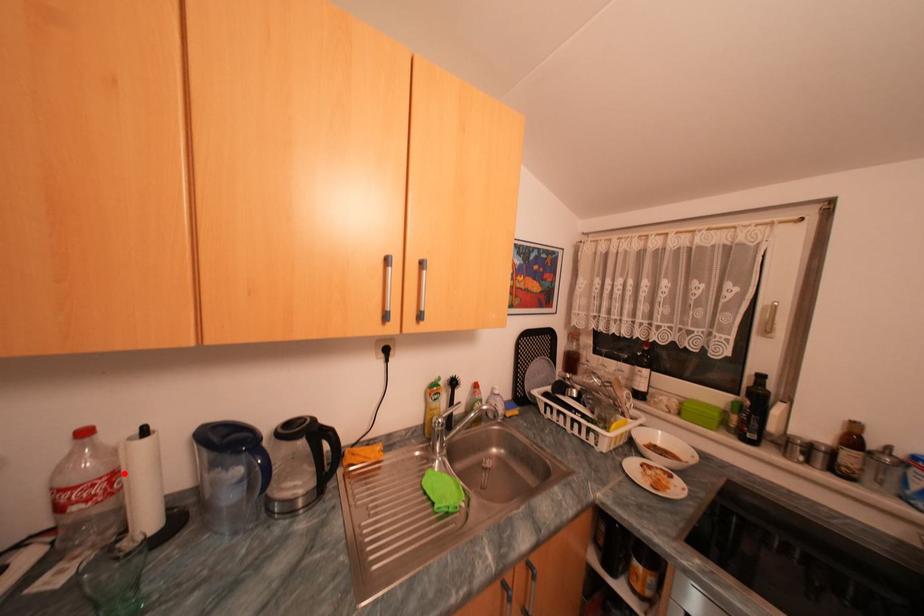
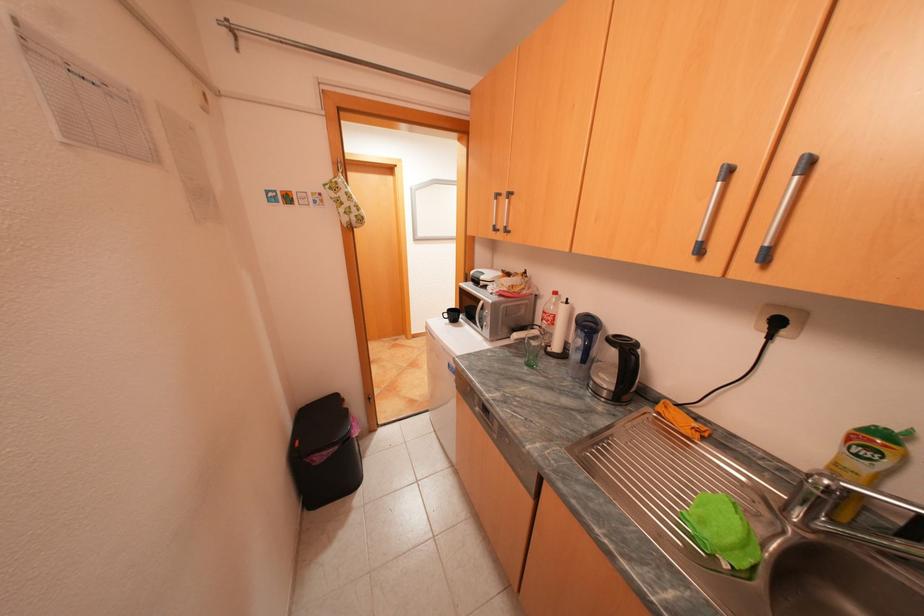
Find the pixel in the second image that matches the highlighted location in the first image.

(565, 315)